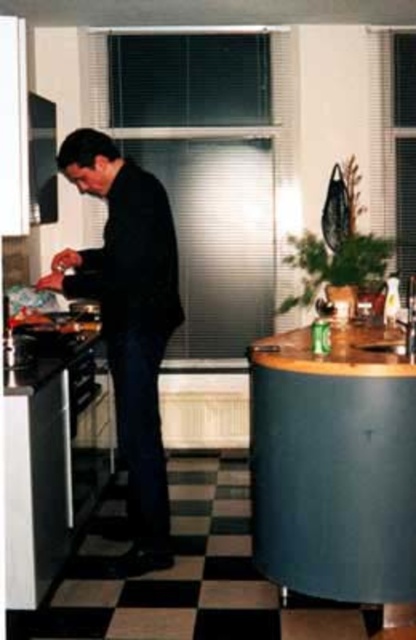
Question: Does wooden laminate counter at right have a greater width compared to brown wood counter at right?

Choices:
 (A) no
 (B) yes

Answer: (A)

Question: Considering the relative positions of wooden laminate counter at right and brown wood counter at right in the image provided, where is wooden laminate counter at right located with respect to brown wood counter at right?

Choices:
 (A) left
 (B) right

Answer: (A)

Question: Considering the real-world distances, which object is closest to the black matte suit at center?

Choices:
 (A) brown wood counter at right
 (B) wooden laminate counter at right

Answer: (B)

Question: Among these objects, which one is nearest to the camera?

Choices:
 (A) wooden laminate counter at right
 (B) brown wood counter at right
 (C) black matte suit at center

Answer: (B)

Question: Among these points, which one is farthest from the camera?

Choices:
 (A) (351, 346)
 (B) (165, 257)
 (C) (366, 420)

Answer: (A)

Question: Is wooden laminate counter at right positioned behind black matte suit at center?

Choices:
 (A) yes
 (B) no

Answer: (B)